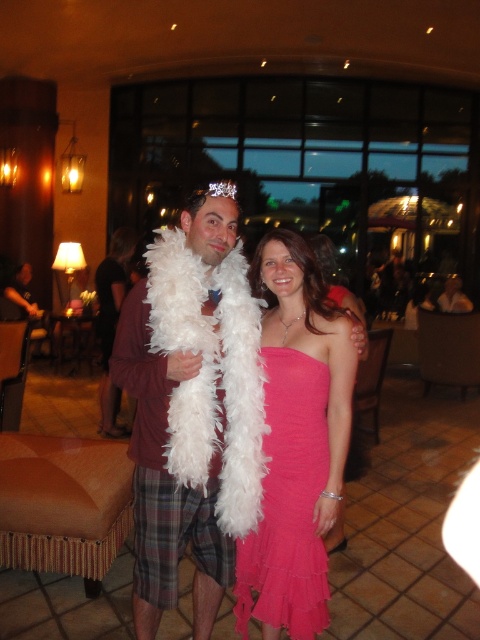
You are a photographer at the party and need to capture a closeup of the clear crystal tiara at upper center without including the pink satin dress at center in the frame. Is this possible given their sizes?

The pink satin dress at center has a smaller size compared to clear crystal tiara at upper center. Since the dress is smaller, it would occupy less space in the frame, making it possible to focus solely on the clear crystal tiara at upper center without including the pink satin dress at center.

You are a photographer at the event and want to capture a photo of the two accessories without any overlap. Given their current positions, is it possible to frame them so that the white feather boa at center and the clear crystal tiara at upper center are both visible and not overlapping?

The white feather boa at center is positioned on the left side of the clear crystal tiara at upper center, so they are already arranged side by side. This means the photographer can frame the shot to include both accessories without overlap by ensuring the camera angle captures the left and right positions of each item relative to each other.

You are planning to take a photo of the pink satin dress at center and the clear crystal tiara at upper center. The camera you have can only focus on objects within 1 meter of each other. Will both items be in focus?

The pink satin dress at center and the clear crystal tiara at upper center are 1.25 meters apart, which exceeds the camera focus range of 1 meter. Therefore, both items cannot be in focus simultaneously.